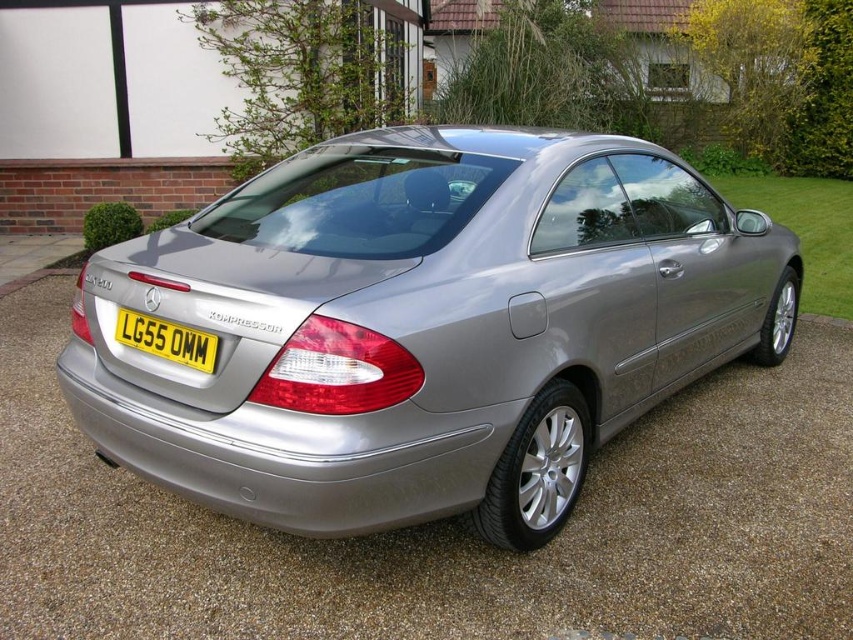
You are a delivery person trying to park your van behind the satin silver car at center. The yellow metallic license plate at rear is blocking the view. Can you see the driveway behind the car?

The satin silver car at center is in front of the yellow metallic license plate at rear, so the car is blocking the view of the driveway behind it. Therefore, you cannot see the driveway behind the car.